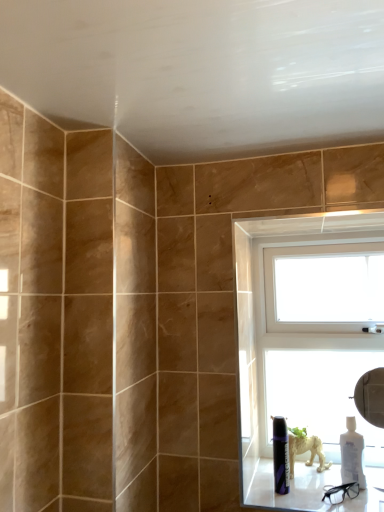
Locate an element on the screen. The image size is (384, 512). free location to the left of matte black can at lower right is located at coordinates (266, 493).